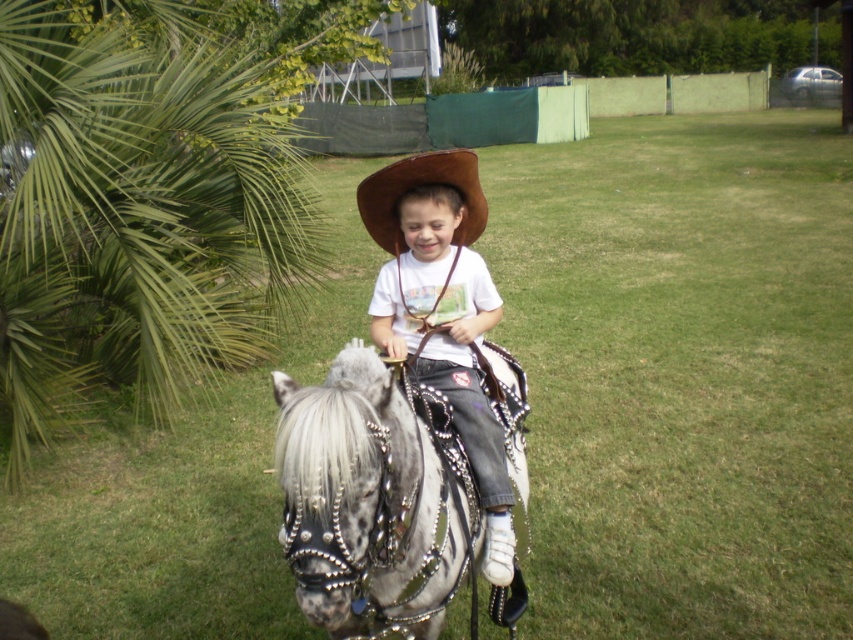
Based on the photo, you are a photographer trying to capture a clear shot of the speckled metallic horse at center and the brown leather cowboy hat at center. Which object should you focus on first to ensure it appears sharp in your photo?

The speckled metallic horse at center is closer to the viewer than the brown leather cowboy hat at center, so you should focus on the speckled metallic horse at center first to ensure it appears sharp.

You are a photographer standing at the camera position. You want to take a photo of the child and horse, but you need to ensure the green leafy palm at left is not in the frame. Is the palm too close to the camera to avoid being in the photo?

The green leafy palm at left is 4.20 meters away from the camera. Since it is positioned at the left side of the scene, it might still be within the frame unless the photographer adjusts their position or angle to exclude it. However, the exact visibility depends on the camera lens and framing chosen.

You are a photographer trying to capture a wide shot of the scene. You need to ensure that both the green leafy palm at left and the matte brown cowboy hat at center are fully visible in the frame. Based on their widths, which object requires more horizontal space in the photo to be fully captured?

The green leafy palm at left requires more horizontal space in the photo to be fully captured because its width surpasses that of the matte brown cowboy hat at center.